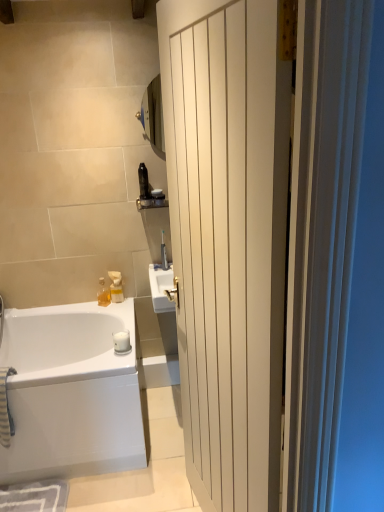
Question: Considering the positions of matte black toothbrush at upper center, which is counted as the third toiletry, starting from the bottom, and translucent plastic soap dispenser at upper center, which appears as the second toiletry when viewed from the left, in the image, is matte black toothbrush at upper center, which is counted as the third toiletry, starting from the bottom, bigger or smaller than translucent plastic soap dispenser at upper center, which appears as the second toiletry when viewed from the left,?

Choices:
 (A) small
 (B) big

Answer: (A)

Question: From the image's perspective, relative to translucent plastic soap dispenser at upper center, which appears as the second toiletry when viewed from the left, is matte black toothbrush at upper center, the 1th toiletry viewed from the right, above or below?

Choices:
 (A) above
 (B) below

Answer: (A)

Question: Based on their relative distances, which object is farther from the white matte soap at lower center?

Choices:
 (A) matte black toothbrush at upper center, placed as the second toiletry when sorted from top to bottom
 (B) black plastic bottle at upper center, which ranks as the 4th toiletry in bottom-to-top order
 (C) satin nickel faucet at upper center
 (D) white glossy bathtub at lower left
 (E) translucent plastic soap dispenser at upper center, which appears as the second toiletry when viewed from the left

Answer: (B)

Question: Estimate the real-world distances between objects in this image. Which object is farther from the matte black toothbrush at upper center, placed as the second toiletry when sorted from top to bottom?

Choices:
 (A) translucent plastic soap dispenser at upper center, placed as the 3th toiletry when sorted from top to bottom
 (B) translucent glass bottle at lower left, positioned as the fourth toiletry in top-to-bottom order
 (C) white glossy bathtub at lower left
 (D) satin nickel faucet at upper center
 (E) black plastic bottle at upper center, arranged as the 2th toiletry when viewed from the right

Answer: (C)